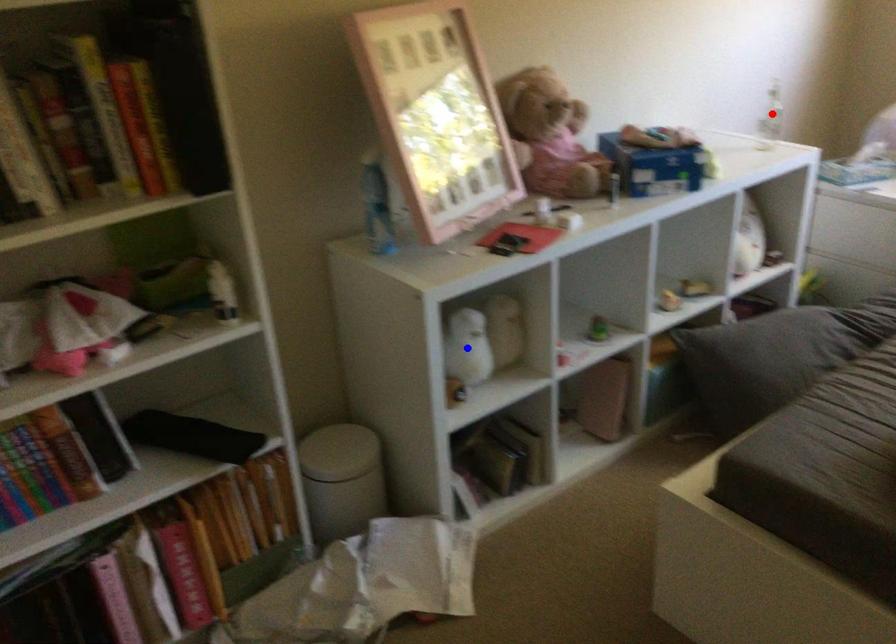
Question: Two points are marked on the image. Which point is closer to the camera?

Choices:
 (A) Blue point is closer.
 (B) Red point is closer.

Answer: (A)